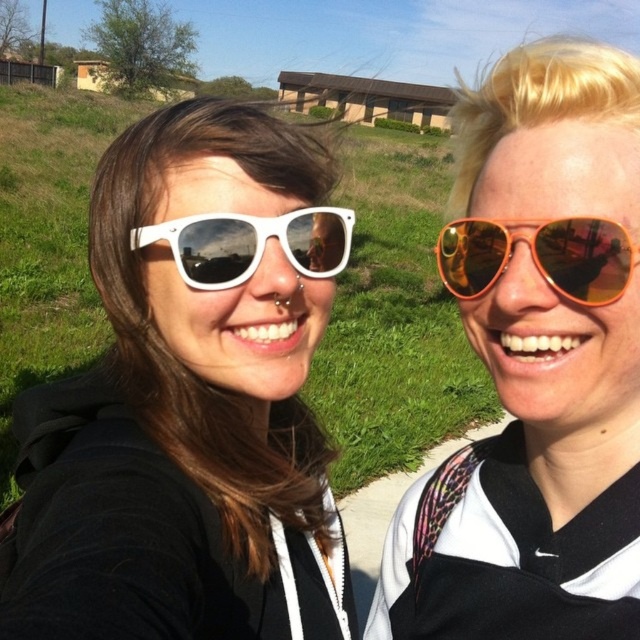
You are trying to decide which pair of sunglasses to buy based on their height. You have the white matte sunglasses at upper left and the orange reflective sunglasses at right. Which one is taller?

The white matte sunglasses at upper left is taller than the orange reflective sunglasses at right.

You are a photographer trying to capture a photo of both the orange reflective sunglasses at right and the white matte sunglasses at center. Since you want both to be in focus, which one should you focus on first to ensure depth of field?

The orange reflective sunglasses at right is closer to the viewer than the white matte sunglasses at center. To ensure both are in focus, you should focus on the white matte sunglasses at center, as focusing on the farther object helps capture the closer one within the depth of field.

You are trying to locate the orange reflective sunglasses at upper right in the image. What are their coordinates?

The orange reflective sunglasses at upper right are located at coordinates 0.573 and 0.839.